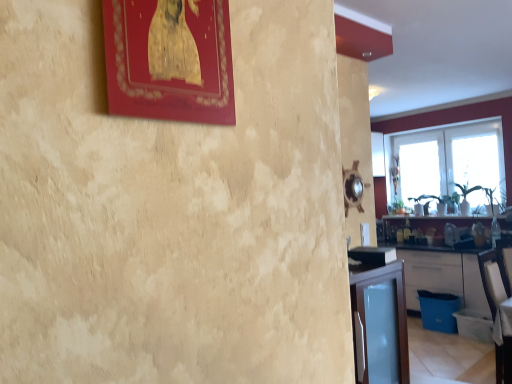
Question: From a real-world perspective, relative to transparent glass window at upper right, the first window when ordered from back to front, is transparent glass window at right vertically above or below?

Choices:
 (A) below
 (B) above

Answer: (B)

Question: From the image's perspective, is transparent glass window at right positioned above or below transparent glass window at upper right, the first window when ordered from back to front?

Choices:
 (A) below
 (B) above

Answer: (B)

Question: Which of these objects is positioned closest to the transparent glass window at upper right, the first window when ordered from back to front?

Choices:
 (A) white matte cabinet at lower right
 (B) transparent glass window at right, acting as the 1th window starting from the front
 (C) matte gold picture frame at upper left
 (D) transparent glass window at right
 (E) white fabric armchair at lower right

Answer: (D)

Question: Estimate the real-world distances between objects in this image. Which object is farther from the transparent glass window at right, positioned as the second window in back-to-front order?

Choices:
 (A) matte gold picture frame at upper left
 (B) transparent glass window at right
 (C) white fabric armchair at lower right
 (D) transparent glass window at upper right, arranged as the 2th window when viewed from the front
 (E) white matte cabinet at lower right

Answer: (A)